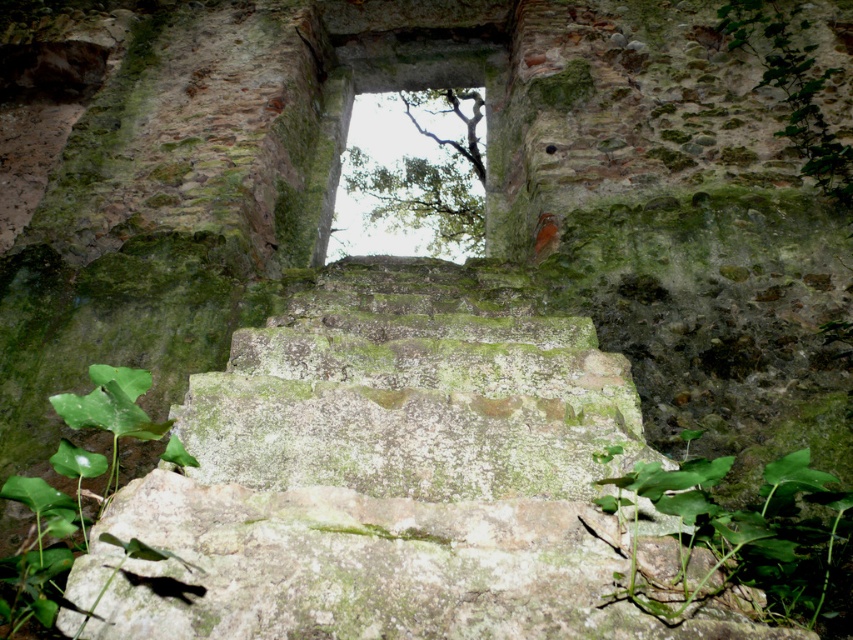
Is green leafy tree at upper center wider than green leafy plant at lower left?

Correct, the width of green leafy tree at upper center exceeds that of green leafy plant at lower left.

Can you confirm if green leafy tree at upper center is shorter than green leafy plant at lower left?

No, green leafy tree at upper center is not shorter than green leafy plant at lower left.

The height and width of the screenshot is (640, 853). In order to click on green leafy tree at upper center in this screenshot , I will do `click(415, 172)`.

Does green leafy plant at lower right appear under green leafy plant at lower left?

Correct, green leafy plant at lower right is located below green leafy plant at lower left.

Who is shorter, green leafy plant at lower right or green leafy plant at lower left?

Standing shorter between the two is green leafy plant at lower left.

Does point (630, 506) lie in front of point (138, 385)?

Yes, it is in front of point (138, 385).

Locate an element on the screen. The height and width of the screenshot is (640, 853). green leafy plant at lower right is located at coordinates (741, 531).

Who is more forward, (730, 456) or (428, 128)?

Positioned in front is point (730, 456).

Does green leafy plant at lower right have a greater height compared to green leafy tree at upper center?

In fact, green leafy plant at lower right may be shorter than green leafy tree at upper center.

Where is `green leafy plant at lower right`? This screenshot has height=640, width=853. green leafy plant at lower right is located at coordinates (741, 531).

You are a GUI agent. You are given a task and a screenshot of the screen. Output one action in this format:
    pyautogui.click(x=<x>, y=<y>)
    Task: Click on the green leafy plant at lower right
    This screenshot has width=853, height=640.
    Given the screenshot: What is the action you would take?
    pyautogui.click(x=741, y=531)